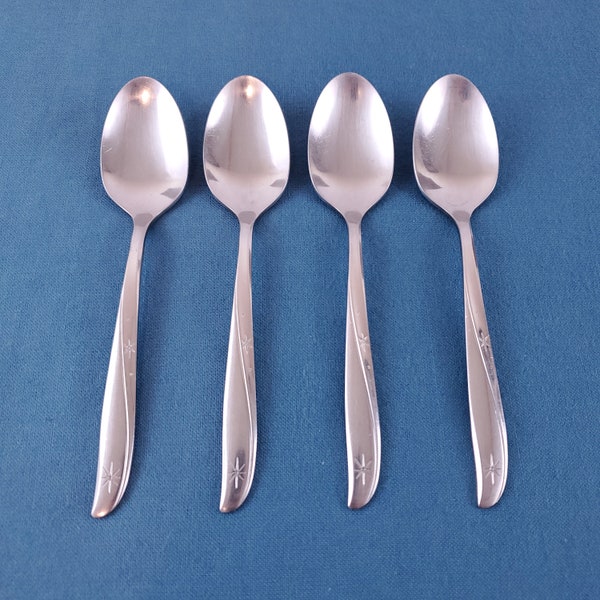
At what (x,y) coordinates should I click in order to perform the action: click on spoon. Please return your answer as a coordinate pair (x, y). Looking at the image, I should click on (442, 147), (324, 147), (217, 143), (105, 133).